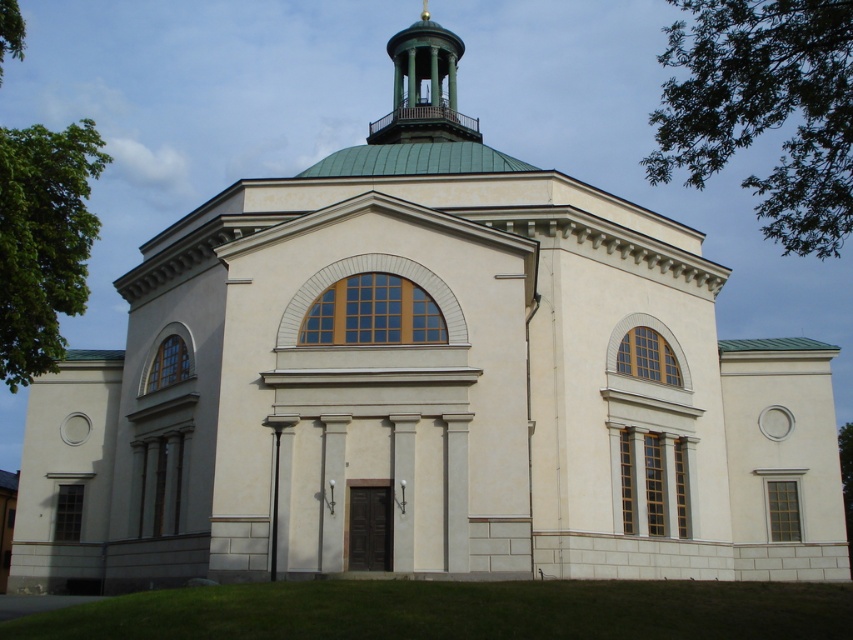
What is located at the coordinate point (x=764, y=109) in the image?

The green leafy tree at upper right is located at point (x=764, y=109).

You are an architect designing a new garden layout for the church. You need to place a bench between the green leafy tree at upper right and the green matte dome at upper center. Which side of the bench should face the tree to ensure it is closer to the tree than the dome?

The bench should face the green leafy tree at upper right because the tree is wider than the dome, so placing the bench closer to the tree would ensure it is nearer to the tree than the dome.